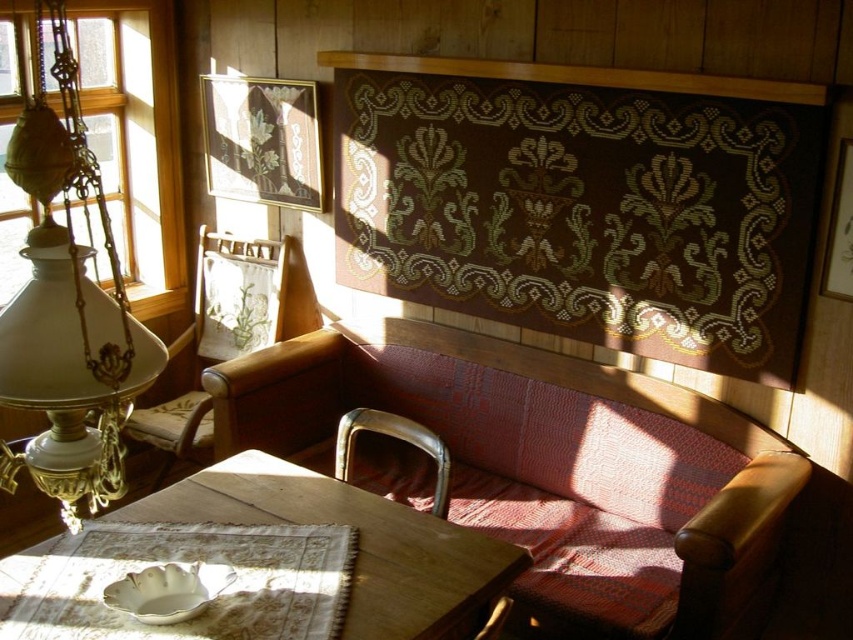
You are standing in the room and want to place a 1.5 meter long decorative item on the wooden table at center. Can you fit it on the table without moving anything else?

The wooden table at center is 1.49 meters away from the camera, which indicates its length might be shorter than 1.5 meters. Therefore, the decorative item may not fit without moving something else.

You are a guest entering the room and want to sit down. Which object, the wooden table at center or the metallic gold armchair at lower center, is more suitable for sitting?

The metallic gold armchair at lower center is more suitable for sitting because the wooden table at center is much taller, making it less comfortable for sitting.